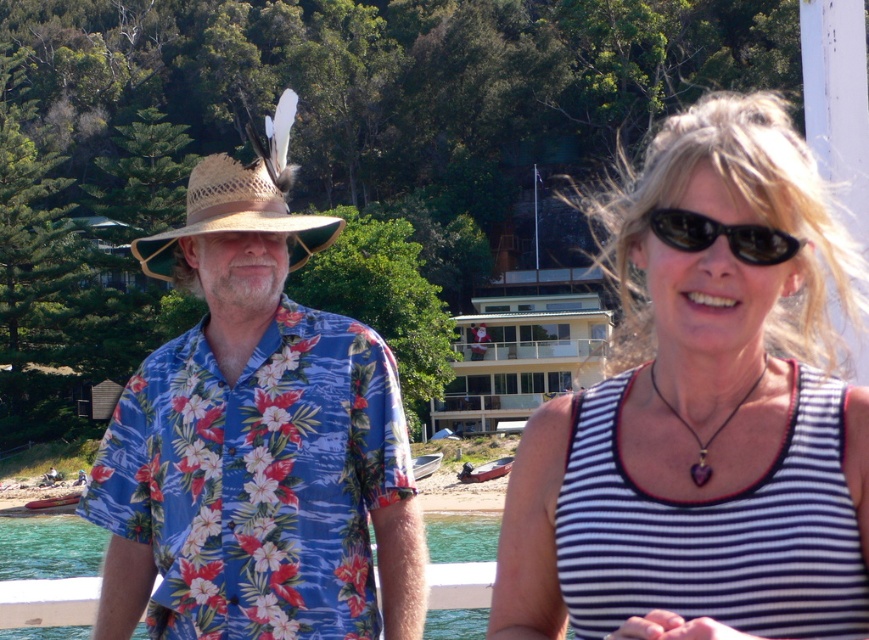
Is point (241, 170) positioned after point (753, 244)?

Yes, it is.

Can you confirm if strawhat at left is positioned to the left of black plastic sunglasses at upper right?

Indeed, strawhat at left is positioned on the left side of black plastic sunglasses at upper right.

Does point (226, 180) come farther from viewer compared to point (668, 209)?

That is True.

This screenshot has height=640, width=869. I want to click on strawhat at left, so click(237, 212).

Can you confirm if white striped tank top at center is taller than floral print fabric shirt at left?

Yes, white striped tank top at center is taller than floral print fabric shirt at left.

Locate an element on the screen. white striped tank top at center is located at coordinates (702, 412).

Who is more distant from viewer, (x=674, y=241) or (x=156, y=371)?

Point (x=156, y=371)

Locate an element on the screen. Image resolution: width=869 pixels, height=640 pixels. white striped tank top at center is located at coordinates (702, 412).

Can you confirm if floral print fabric shirt at left is shorter than black plastic sunglasses at upper right?

No.

Can you confirm if floral print fabric shirt at left is smaller than black plastic sunglasses at upper right?

Incorrect, floral print fabric shirt at left is not smaller in size than black plastic sunglasses at upper right.

Where is `floral print fabric shirt at left`? This screenshot has height=640, width=869. floral print fabric shirt at left is located at coordinates (257, 477).

Locate an element on the screen. Image resolution: width=869 pixels, height=640 pixels. floral print fabric shirt at left is located at coordinates (257, 477).